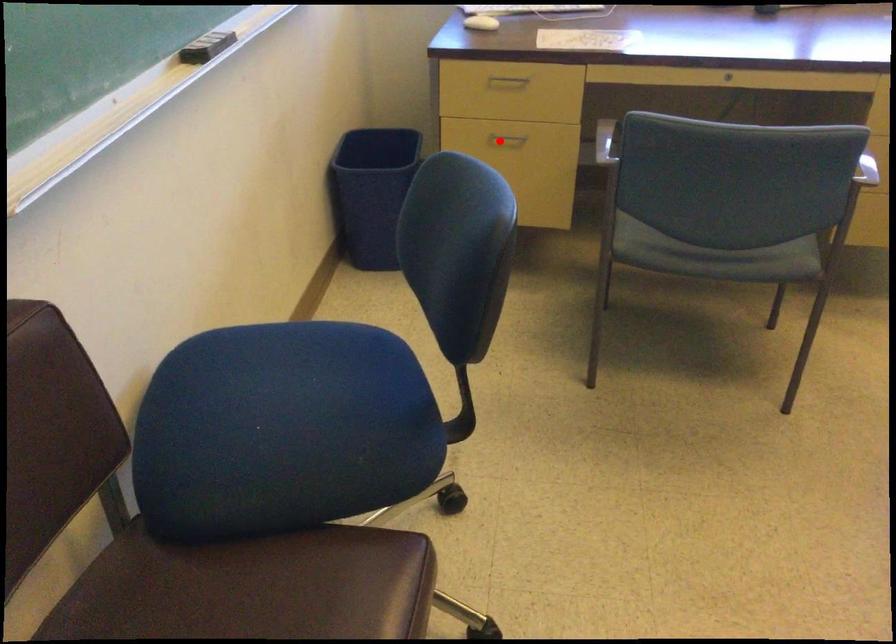
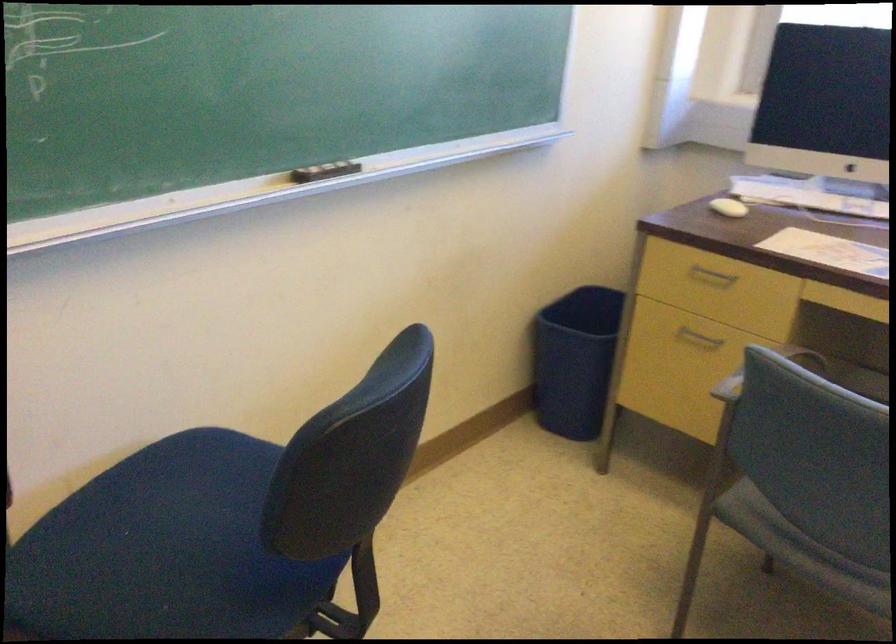
Question: I am providing you with two images of the same scene from different viewpoints. In image1, a red point is highlighted. Considering the same 3D point in image2, which of the following is correct?

Choices:
 (A) It is closer
 (B) It is farther

Answer: (A)